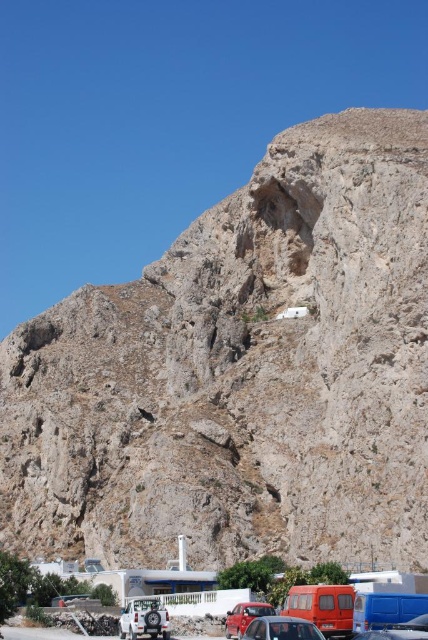
Question: Considering the relative positions of shiny red car at center and blue metallic van at lower right in the image provided, where is shiny red car at center located with respect to blue metallic van at lower right?

Choices:
 (A) left
 (B) right

Answer: (A)

Question: Which point is farther to the camera?

Choices:
 (A) (362, 516)
 (B) (127, 637)
 (C) (395, 628)

Answer: (A)

Question: In this image, where is shiny red car at center located relative to matte red car at center?

Choices:
 (A) above
 (B) below

Answer: (A)

Question: Considering the relative positions of white matte truck at lower left and metallic red car at lower center in the image provided, where is white matte truck at lower left located with respect to metallic red car at lower center?

Choices:
 (A) above
 (B) below

Answer: (B)

Question: Estimate the real-world distances between objects in this image. Which object is closer to the blue metallic van at lower right?

Choices:
 (A) rugged stone mountain at upper center
 (B) white matte truck at lower left

Answer: (B)

Question: Among these points, which one is nearest to the camera?

Choices:
 (A) (58, 634)
 (B) (359, 634)
 (C) (243, 627)

Answer: (B)